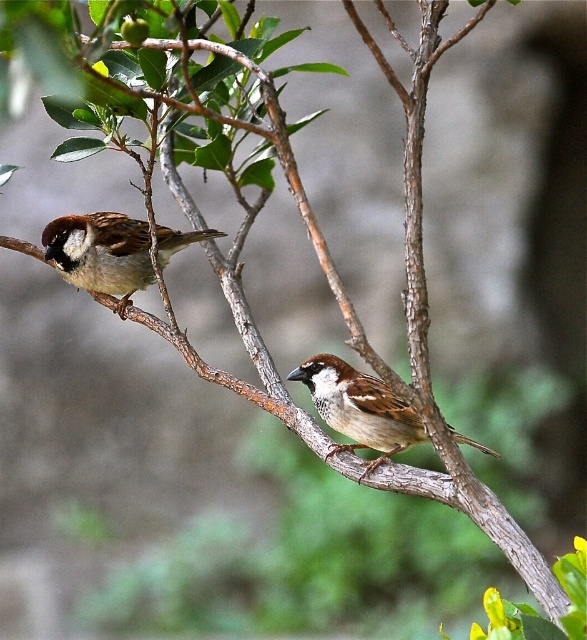
You are a birdwatcher observing two sparrows in a tree. You see the brown matte sparrow at left and the brown feathered sparrow at center. Which sparrow is located more to the left in the image?

The brown matte sparrow at left is more to the left than the brown feathered sparrow at center.

You are a photographer trying to focus on two points in the image. The first point is point (104, 248) and the second point is point (392, 404). Given the shallow depth of field, which point is closer to you?

Point (104, 248) is closer to you than point (392, 404) because it is further to the viewer according to the description.